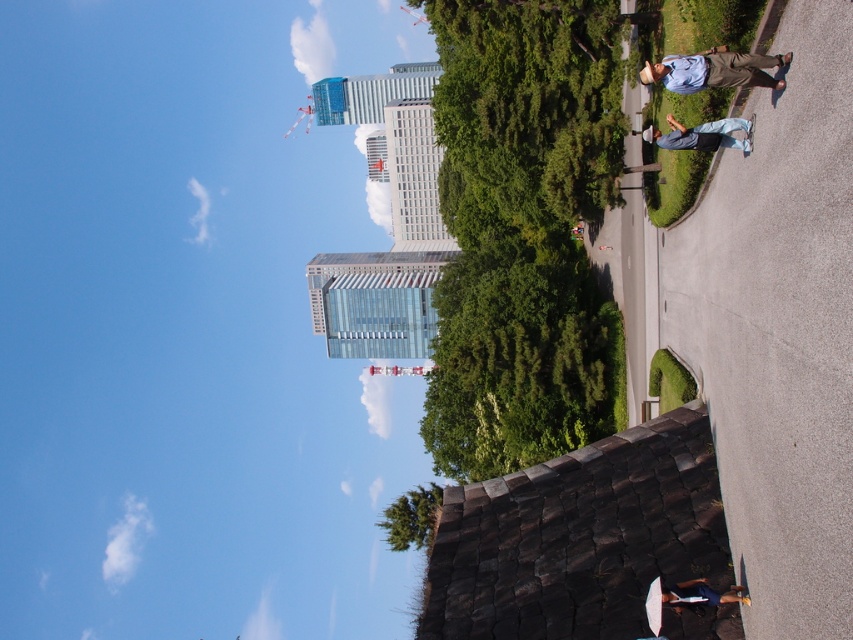
Question: Is blue denim jeans at right smaller than wooden skateboard at lower right?

Choices:
 (A) yes
 (B) no

Answer: (B)

Question: Which of the following is the closest to the observer?

Choices:
 (A) (663, 592)
 (B) (381, 509)

Answer: (A)

Question: Can you confirm if light blue denim jeans at upper right is bigger than green leafy tree at lower center?

Choices:
 (A) no
 (B) yes

Answer: (A)

Question: Which is farther from the light blue denim jeans at upper right?

Choices:
 (A) wooden skateboard at lower right
 (B) blue denim jeans at right
 (C) green leafy tree at center
 (D) green leafy tree at lower center

Answer: (D)

Question: Estimate the real-world distances between objects in this image. Which object is farther from the wooden skateboard at lower right?

Choices:
 (A) green leafy tree at center
 (B) green leafy tree at lower center

Answer: (A)

Question: Can you confirm if green leafy tree at center is smaller than light blue denim jeans at upper right?

Choices:
 (A) no
 (B) yes

Answer: (A)